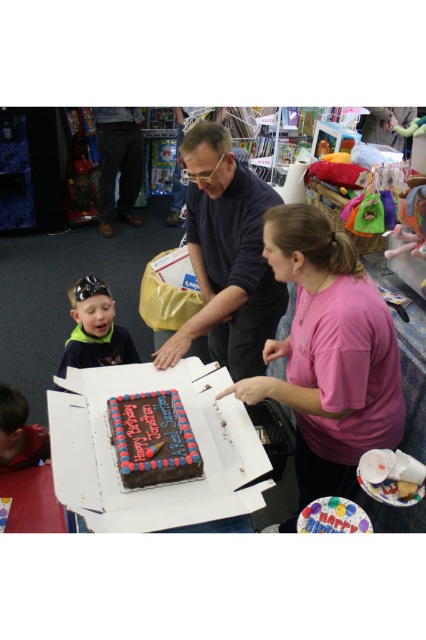
What object is located at the coordinates point (328, 355)?

The point (328, 355) indicates the pink matte shirt at center.

You are a guest at the birthday party and want to know which object is bigger between the matte cardboard box at center and the chocolate frosted cake at center. Can you tell me?

The matte cardboard box at center is larger in size than the chocolate frosted cake at center, so the matte cardboard box at center is bigger.

Where is the pink matte shirt at center located in the image?

The pink matte shirt at center is located at point coordinates of (x=328, y=355).